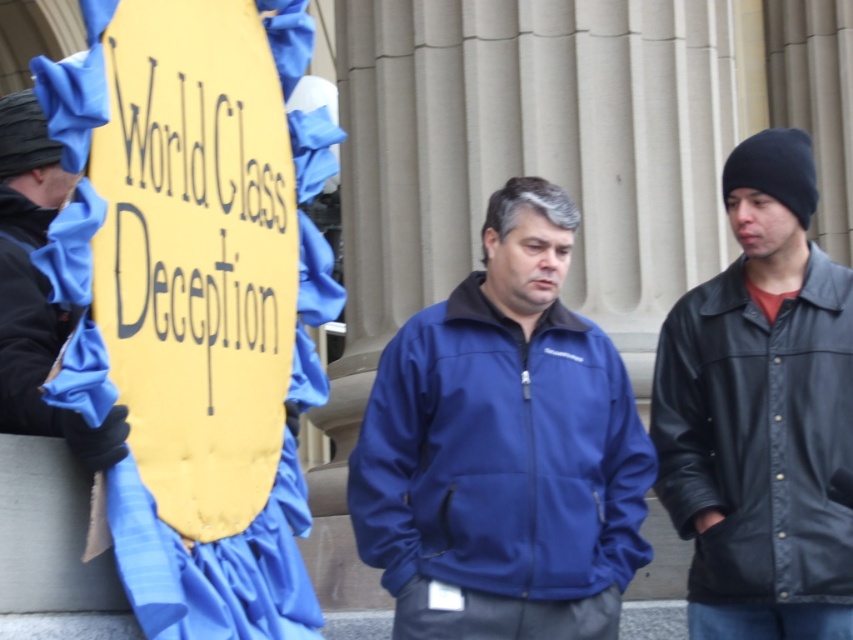
Question: Can you confirm if black leather jacket at right is positioned to the left of matte blue jacket at center?

Choices:
 (A) yes
 (B) no

Answer: (B)

Question: Observing the image, what is the correct spatial positioning of matte blue jacket at center in reference to black matte jacket at left?

Choices:
 (A) left
 (B) right

Answer: (B)

Question: Among these points, which one is farthest from the camera?

Choices:
 (A) (3, 342)
 (B) (6, 298)
 (C) (761, 244)

Answer: (C)

Question: Among these points, which one is farthest from the camera?

Choices:
 (A) (817, 337)
 (B) (56, 332)
 (C) (404, 449)

Answer: (A)

Question: Is black leather jacket at right in front of black leather jacket at left?

Choices:
 (A) no
 (B) yes

Answer: (A)

Question: Which of these objects is positioned farthest from the black matte jacket at left?

Choices:
 (A) black leather jacket at left
 (B) black leather jacket at right
 (C) matte blue jacket at center

Answer: (B)